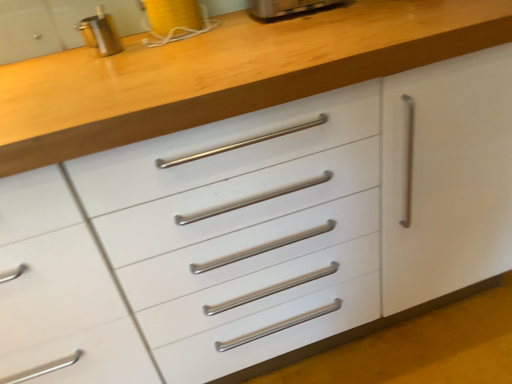
In order to click on metallic silver canister at upper left in this screenshot , I will do `click(100, 33)`.

Describe the element at coordinates (100, 33) in the screenshot. I see `metallic silver canister at upper left` at that location.

You are a GUI agent. You are given a task and a screenshot of the screen. Output one action in this format:
    pyautogui.click(x=<x>, y=<y>)
    Task: Click on the metallic silver canister at upper left
    
    Given the screenshot: What is the action you would take?
    [x=100, y=33]